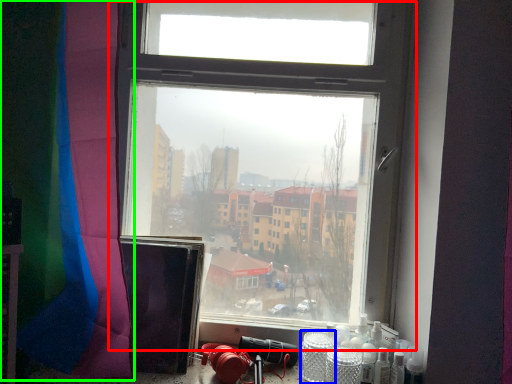
Question: Which object is the farthest from window (highlighted by a red box)? Choose among these: glass jar (highlighted by a blue box) or curtain (highlighted by a green box).

Choices:
 (A) glass jar
 (B) curtain

Answer: (A)